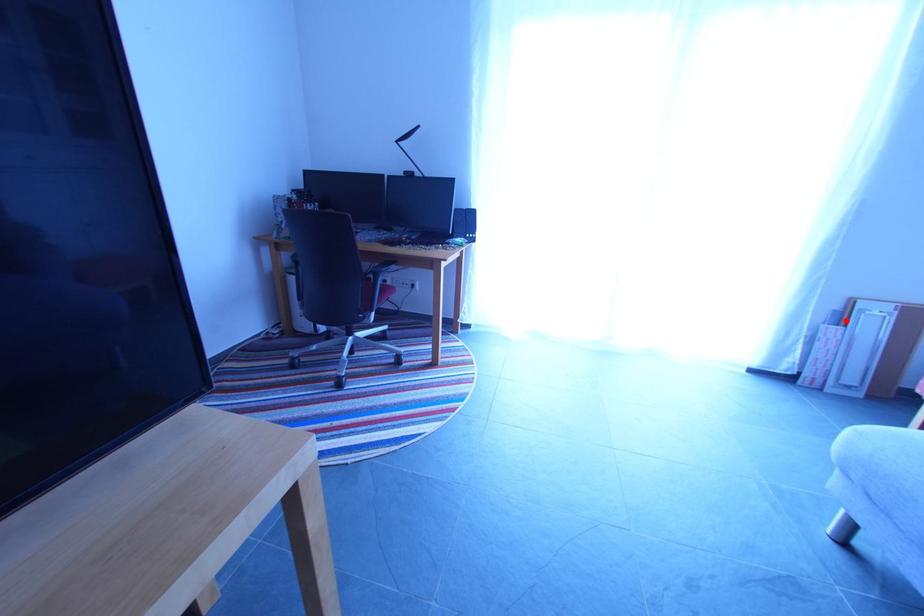
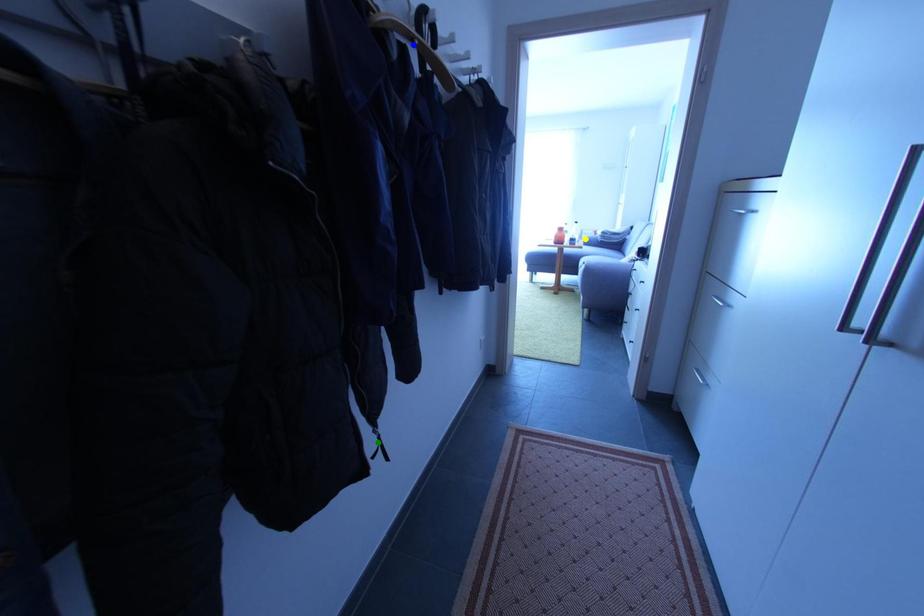
Question: I am providing you with two images of the same scene from different viewpoints. A red point is marked on the first image. You are given multiple points on the second image. Which mark in image 2 goes with the point in image 1?

Choices:
 (A) blue point
 (B) green point
 (C) yellow point

Answer: (C)